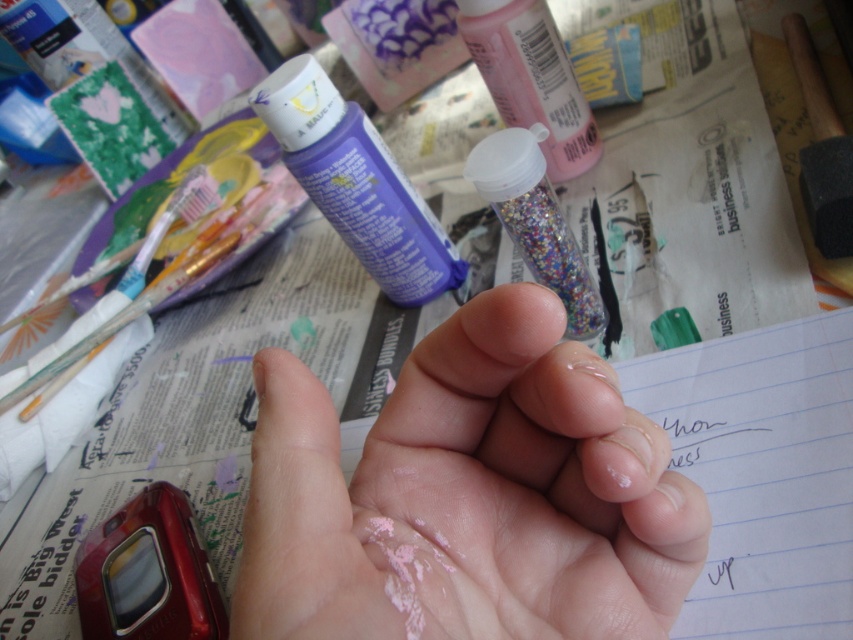
You need to place a small sticker exactly between the purple matte tube at upper center and the shiny plastic glitter container at center. Which object should you use as a reference point to ensure the sticker is centered?

The purple matte tube at upper center is positioned on the left side of the shiny plastic glitter container at center. To center the sticker between them, use the midpoint between the two objects as the reference point.

You are an artist who needs to choose between the pink matte paint at center and the shiny plastic glitter container at center for a project that requires a larger container. Which object should you select?

The pink matte paint at center is larger in size than the shiny plastic glitter container at center, so you should select the pink matte paint at center for the project.